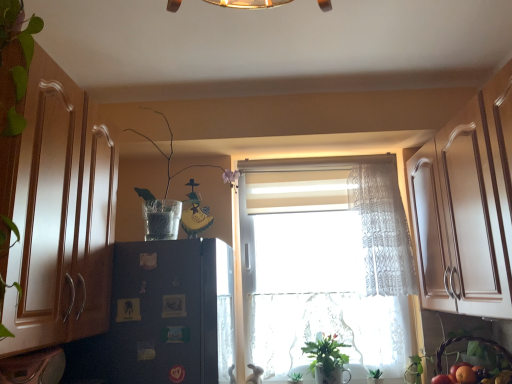
Question: From the image's perspective, is orange matte at lower right on top of clear glass vase at upper center, the second plant from the back?

Choices:
 (A) yes
 (B) no

Answer: (B)

Question: Can you confirm if orange matte at lower right is positioned to the right of clear glass vase at upper center, the 2th plant from the bottom?

Choices:
 (A) no
 (B) yes

Answer: (B)

Question: From the image's perspective, does orange matte at lower right appear lower than clear glass vase at upper center, acting as the first plant starting from the left?

Choices:
 (A) no
 (B) yes

Answer: (B)

Question: Is orange matte at lower right aimed at clear glass vase at upper center, the first plant when ordered from top to bottom?

Choices:
 (A) no
 (B) yes

Answer: (A)

Question: Is orange matte at lower right not close to clear glass vase at upper center, the first plant when ordered from front to back?

Choices:
 (A) no
 (B) yes

Answer: (B)

Question: From a real-world perspective, relative to green leafy plant at lower center, positioned as the 1th plant in back-to-front order, is wooden cabinet at left vertically above or below?

Choices:
 (A) above
 (B) below

Answer: (A)

Question: Looking at their shapes, would you say wooden cabinet at left is wider or thinner than green leafy plant at lower center, which is the 2th plant in left-to-right order?

Choices:
 (A) thin
 (B) wide

Answer: (B)

Question: Based on their positions, is wooden cabinet at left located to the left or right of green leafy plant at lower center, the 2th plant when ordered from top to bottom?

Choices:
 (A) left
 (B) right

Answer: (A)

Question: From their relative heights in the image, would you say wooden cabinet at left is taller or shorter than green leafy plant at lower center, which is the 2th plant in left-to-right order?

Choices:
 (A) tall
 (B) short

Answer: (A)

Question: Is brown woven basket at lower right situated inside green leafy plant at lower center, placed as the 2th plant when sorted from front to back, or outside?

Choices:
 (A) inside
 (B) outside

Answer: (B)

Question: From the image's perspective, is brown woven basket at lower right located above or below green leafy plant at lower center, positioned as the 1th plant in back-to-front order?

Choices:
 (A) below
 (B) above

Answer: (B)

Question: Would you say brown woven basket at lower right is to the left or to the right of green leafy plant at lower center, the first plant viewed from the right, in the picture?

Choices:
 (A) right
 (B) left

Answer: (A)

Question: In the image, is brown woven basket at lower right positioned in front of or behind green leafy plant at lower center, placed as the 2th plant when sorted from front to back?

Choices:
 (A) behind
 (B) front

Answer: (B)

Question: Based on their positions, is white lace curtain at center located to the left or right of black matte refrigerator at left?

Choices:
 (A) right
 (B) left

Answer: (A)

Question: Considering their positions, is white lace curtain at center located in front of or behind black matte refrigerator at left?

Choices:
 (A) behind
 (B) front

Answer: (A)